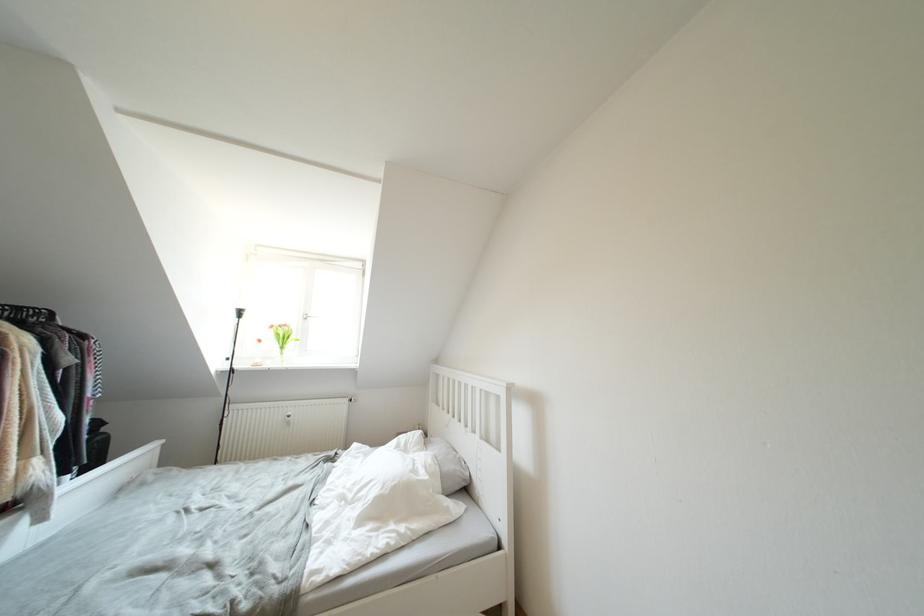
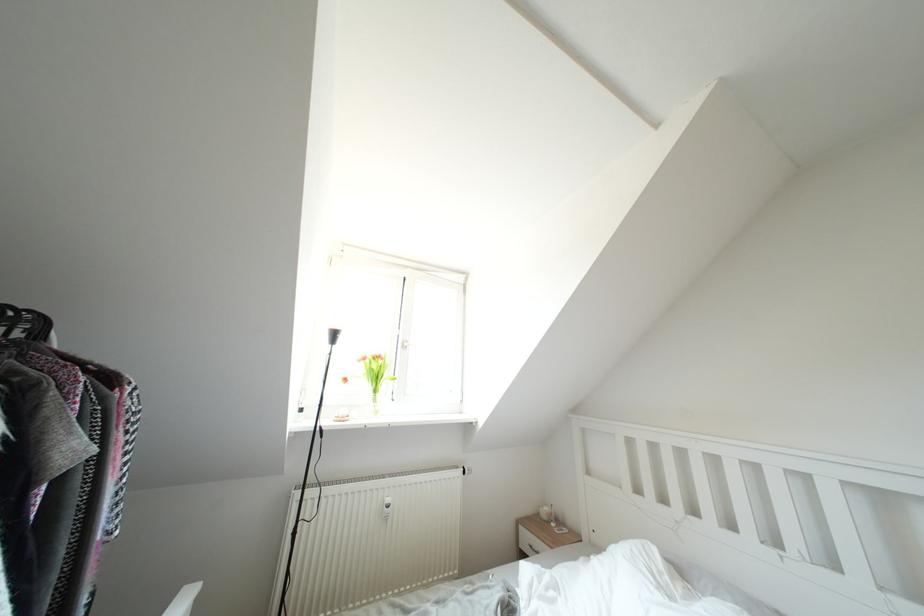
Based on the photo, which direction would the cameraman need to move to produce the second image?

The cameraman walked toward left, forward.